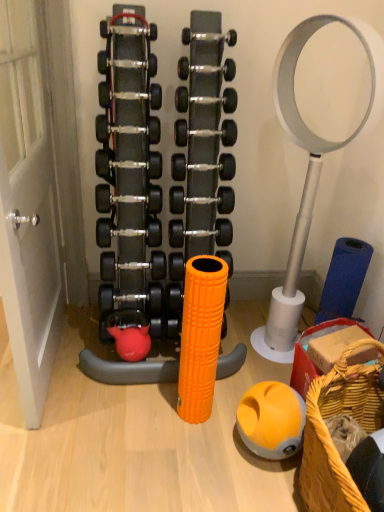
Image resolution: width=384 pixels, height=512 pixels. I want to click on vacant space underneath white matte door at left (from a real-world perspective), so click(x=60, y=356).